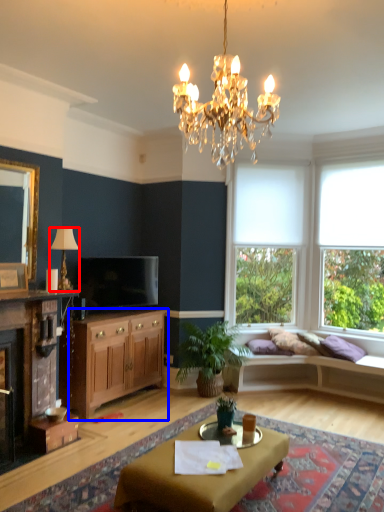
Question: Which of the following is the farthest to the observer, lamp (highlighted by a red box) or cabinetry (highlighted by a blue box)?

Choices:
 (A) lamp
 (B) cabinetry

Answer: (B)